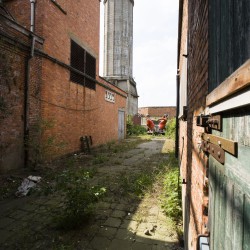
I want to click on trash, so click(x=25, y=187).